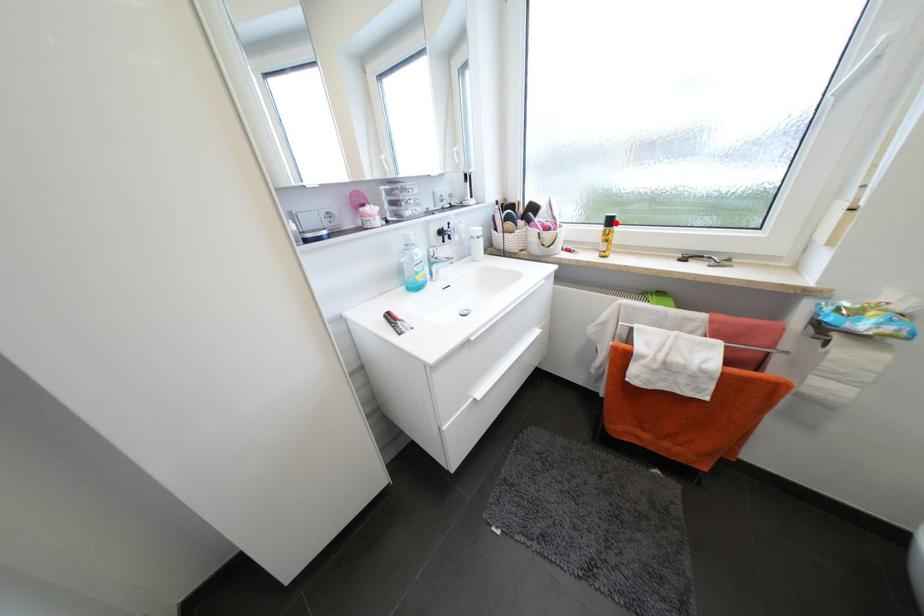
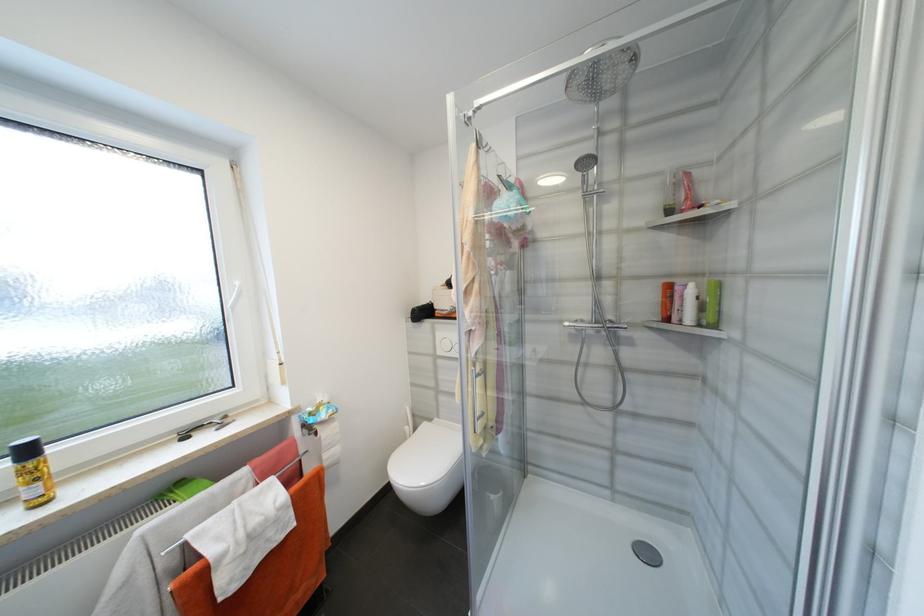
Locate, in the second image, the point that corresponds to the highlighted location in the first image.

(33, 453)